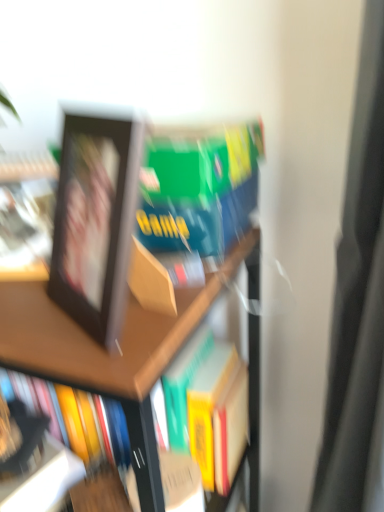
Question: Is matte black photo frame at left completely or partially outside of black matte picture frame at upper left?

Choices:
 (A) no
 (B) yes

Answer: (B)

Question: Can you confirm if matte black photo frame at left is wider than black matte picture frame at upper left?

Choices:
 (A) no
 (B) yes

Answer: (A)

Question: Does matte black photo frame at left have a larger size compared to black matte picture frame at upper left?

Choices:
 (A) yes
 (B) no

Answer: (B)

Question: Would you say matte black photo frame at left is a long distance from black matte picture frame at upper left?

Choices:
 (A) yes
 (B) no

Answer: (B)

Question: Is black matte picture frame at upper left surrounded by matte black photo frame at left?

Choices:
 (A) no
 (B) yes

Answer: (A)

Question: From their relative heights in the image, would you say matte black photo frame at left is taller or shorter than black matte picture frame at upper left?

Choices:
 (A) tall
 (B) short

Answer: (B)

Question: From a real-world perspective, is matte black photo frame at left physically located above or below black matte picture frame at upper left?

Choices:
 (A) above
 (B) below

Answer: (B)

Question: Is matte black photo frame at left spatially inside black matte picture frame at upper left, or outside of it?

Choices:
 (A) inside
 (B) outside

Answer: (B)

Question: Looking at the image, does matte black photo frame at left seem bigger or smaller compared to black matte picture frame at upper left?

Choices:
 (A) small
 (B) big

Answer: (A)

Question: Is matte black photo frame at left wider or thinner than wooden bookshelf at upper left?

Choices:
 (A) wide
 (B) thin

Answer: (B)

Question: Is point (0, 257) positioned closer to the camera than point (251, 227)?

Choices:
 (A) closer
 (B) farther

Answer: (A)

Question: Choose the correct answer: Is matte black photo frame at left inside wooden bookshelf at upper left or outside it?

Choices:
 (A) outside
 (B) inside

Answer: (A)

Question: In terms of height, does matte black photo frame at left look taller or shorter compared to wooden bookshelf at upper left?

Choices:
 (A) tall
 (B) short

Answer: (B)

Question: Is black matte picture frame at upper left to the left or to the right of wooden bookshelf at upper left in the image?

Choices:
 (A) left
 (B) right

Answer: (B)

Question: From a real-world perspective, is black matte picture frame at upper left physically located above or below wooden bookshelf at upper left?

Choices:
 (A) below
 (B) above

Answer: (B)